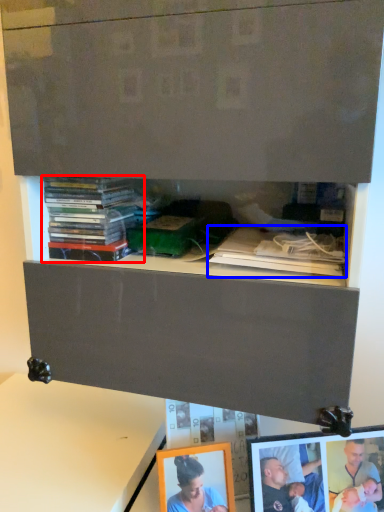
Question: Which of the following is the closest to the observer, book (highlighted by a red box) or book (highlighted by a blue box)?

Choices:
 (A) book
 (B) book

Answer: (B)